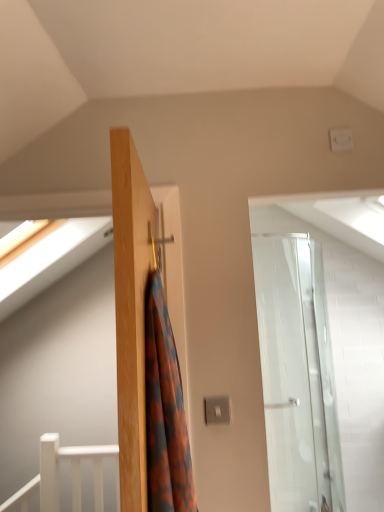
Locate an element on the screen. This screenshot has width=384, height=512. white matte rail at lower left is located at coordinates (71, 475).

What do you see at coordinates (71, 475) in the screenshot?
I see `white matte rail at lower left` at bounding box center [71, 475].

This screenshot has height=512, width=384. I want to click on orange patterned fabric at center, so click(x=165, y=411).

This screenshot has height=512, width=384. Describe the element at coordinates (165, 411) in the screenshot. I see `orange patterned fabric at center` at that location.

At what (x,y) coordinates should I click in order to perform the action: click on white matte rail at lower left. Please return your answer as a coordinate pair (x, y). This screenshot has height=512, width=384. Looking at the image, I should click on (71, 475).

Does orange patterned fabric at center appear on the right side of white matte rail at lower left?

Yes.

Which is behind, orange patterned fabric at center or white matte rail at lower left?

Positioned behind is white matte rail at lower left.

Considering the points (181, 414) and (118, 485), which point is behind, point (181, 414) or point (118, 485)?

Point (181, 414)

From the image's perspective, who appears lower, orange patterned fabric at center or white matte rail at lower left?

white matte rail at lower left.

From a real-world perspective, who is located higher, orange patterned fabric at center or white matte rail at lower left?

In real-world perspective, orange patterned fabric at center is above.

Can you confirm if orange patterned fabric at center is thinner than white matte rail at lower left?

No, orange patterned fabric at center is not thinner than white matte rail at lower left.

Does orange patterned fabric at center have a greater height compared to white matte rail at lower left?

Correct, orange patterned fabric at center is much taller as white matte rail at lower left.

Based on the photo, based on their sizes in the image, would you say orange patterned fabric at center is bigger or smaller than white matte rail at lower left?

Considering their sizes, orange patterned fabric at center takes up more space than white matte rail at lower left.

Does orange patterned fabric at center contain white matte rail at lower left?

No, white matte rail at lower left is located outside of orange patterned fabric at center.

Is orange patterned fabric at center far away from white matte rail at lower left?

Yes, orange patterned fabric at center and white matte rail at lower left are quite far apart.

Consider the image. Is orange patterned fabric at center turned away from white matte rail at lower left?

No, orange patterned fabric at center is not facing the opposite direction of white matte rail at lower left.

Identify the location of shower curtain in front of the white matte rail at lower left. Image resolution: width=384 pixels, height=512 pixels. (165, 411).

Is white matte rail at lower left to the left of orange patterned fabric at center from the viewer's perspective?

Indeed, white matte rail at lower left is positioned on the left side of orange patterned fabric at center.

Which is in front, white matte rail at lower left or orange patterned fabric at center?

orange patterned fabric at center is more forward.

Between point (79, 495) and point (184, 454), which one is positioned behind?

The point (79, 495) is behind.

From the image's perspective, is white matte rail at lower left located above orange patterned fabric at center?

No, from the image's perspective, white matte rail at lower left is not above orange patterned fabric at center.

From a real-world perspective, between white matte rail at lower left and orange patterned fabric at center, who is vertically higher?

In real-world perspective, orange patterned fabric at center is above.

Considering the sizes of white matte rail at lower left and orange patterned fabric at center in the image, is white matte rail at lower left wider or thinner than orange patterned fabric at center?

Considering their sizes, white matte rail at lower left looks slimmer than orange patterned fabric at center.

In terms of height, does white matte rail at lower left look taller or shorter compared to orange patterned fabric at center?

white matte rail at lower left is shorter than orange patterned fabric at center.

Which of these two, white matte rail at lower left or orange patterned fabric at center, is bigger?

orange patterned fabric at center.

From the picture: Do you think white matte rail at lower left is within orange patterned fabric at center, or outside of it?

white matte rail at lower left is not inside orange patterned fabric at center, it's outside.

Are white matte rail at lower left and orange patterned fabric at center beside each other?

They are not placed beside each other.

Is orange patterned fabric at center at the back of white matte rail at lower left?

No, white matte rail at lower left is not facing away from orange patterned fabric at center.

How distant is white matte rail at lower left from orange patterned fabric at center?

white matte rail at lower left and orange patterned fabric at center are 6.59 feet apart from each other.

Locate an element on the screen. This screenshot has width=384, height=512. shower curtain above the white matte rail at lower left (from a real-world perspective) is located at coordinates (165, 411).

You are a GUI agent. You are given a task and a screenshot of the screen. Output one action in this format:
    pyautogui.click(x=<x>, y=<y>)
    Task: Click on the shower curtain above the white matte rail at lower left (from the image's perspective)
    The height and width of the screenshot is (512, 384).
    Given the screenshot: What is the action you would take?
    pyautogui.click(x=165, y=411)

This screenshot has width=384, height=512. In order to click on rail below the orange patterned fabric at center (from a real-world perspective) in this screenshot , I will do `click(71, 475)`.